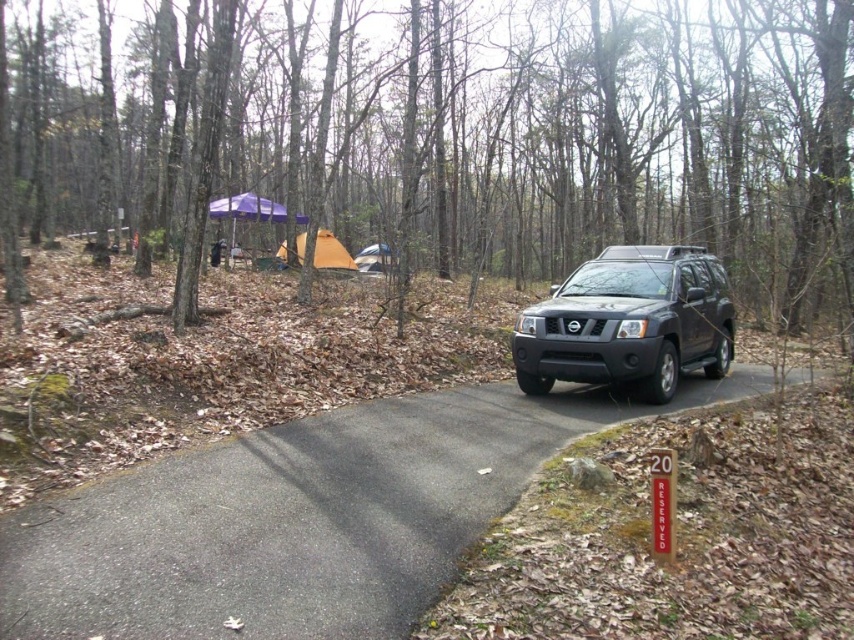
Based on the photo, can you confirm if black matte suv at center is positioned below orange canvas tent at center?

Indeed, black matte suv at center is positioned under orange canvas tent at center.

Which is more to the left, black matte suv at center or orange canvas tent at center?

orange canvas tent at center

This screenshot has width=854, height=640. Describe the element at coordinates (629, 323) in the screenshot. I see `black matte suv at center` at that location.

Where is `black matte suv at center`? The height and width of the screenshot is (640, 854). black matte suv at center is located at coordinates (629, 323).

Is point (302, 260) less distant than point (369, 253)?

Yes, it is.

Is orange fabric tent at center bigger than orange canvas tent at center?

Indeed, orange fabric tent at center has a larger size compared to orange canvas tent at center.

Locate an element on the screen. This screenshot has height=640, width=854. orange fabric tent at center is located at coordinates (330, 252).

Does brown bark tree at center have a smaller size compared to orange canvas tent at center?

No, brown bark tree at center is not smaller than orange canvas tent at center.

Who is lower down, brown bark tree at center or orange canvas tent at center?

orange canvas tent at center

Identify the location of brown bark tree at center. The image size is (854, 640). (446, 136).